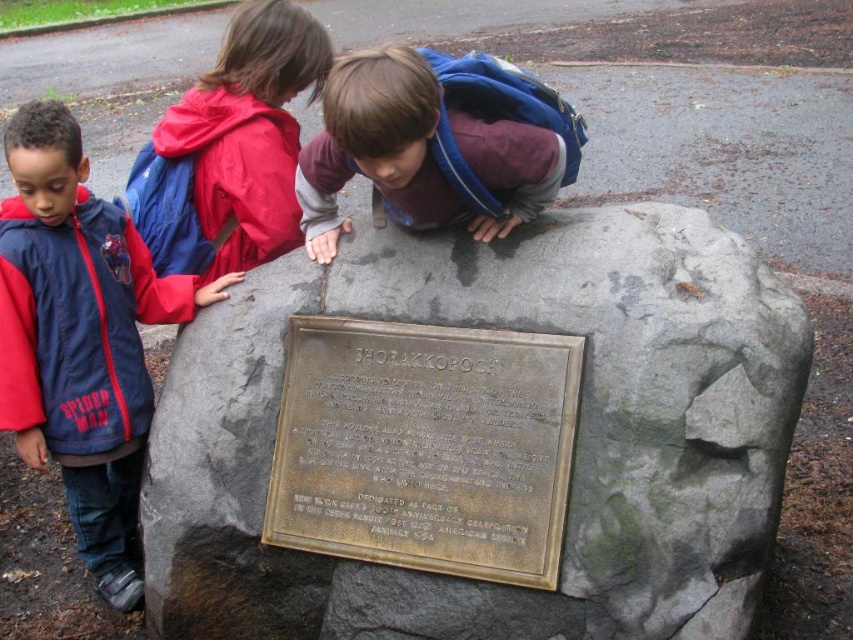
Is point (608, 250) positioned before point (225, 200)?

Yes.

What do you see at coordinates (573, 442) in the screenshot?
I see `gray stone plaque at center` at bounding box center [573, 442].

Find the location of a particular element. gray stone plaque at center is located at coordinates (573, 442).

This screenshot has width=853, height=640. Find the location of `gray stone plaque at center`. gray stone plaque at center is located at coordinates (573, 442).

Is gray stone plaque at center below blue backpack at center?

Yes, gray stone plaque at center is below blue backpack at center.

Does point (480, 627) come behind point (416, 186)?

No.

The width and height of the screenshot is (853, 640). In order to click on gray stone plaque at center in this screenshot , I will do `click(573, 442)`.

At what (x,y) coordinates should I click in order to perform the action: click on blue backpack at center. Please return your answer as a coordinate pair (x, y). The width and height of the screenshot is (853, 640). Looking at the image, I should click on (436, 144).

Is blue backpack at center to the left of red nylon backpack at upper left from the viewer's perspective?

In fact, blue backpack at center is to the right of red nylon backpack at upper left.

Which is behind, point (461, 118) or point (252, 241)?

The point (252, 241) is behind.

Find the location of a particular element. The image size is (853, 640). blue backpack at center is located at coordinates (436, 144).